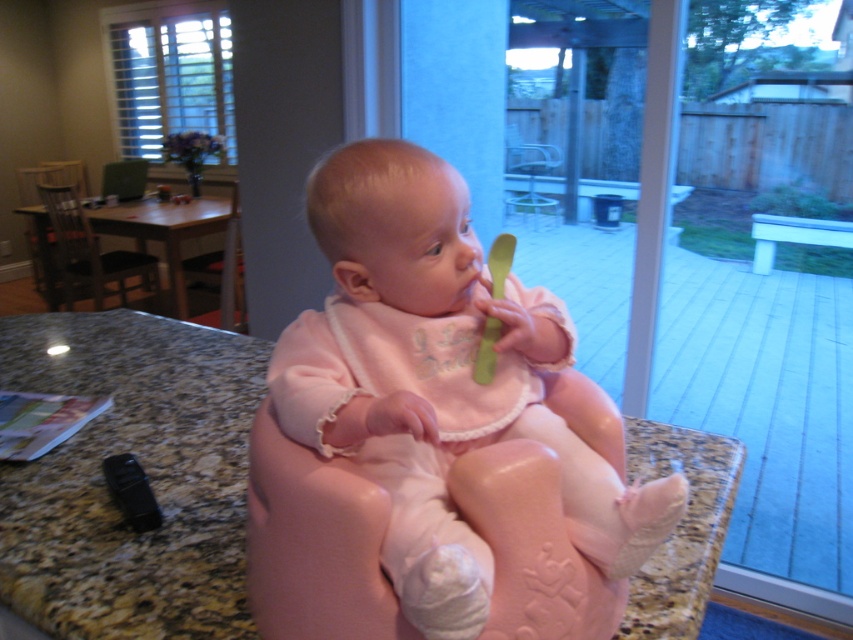
Question: Which point is closer to the camera?

Choices:
 (A) pink fabric baby at center
 (B) granite countertop at center

Answer: (A)

Question: Is pink fabric baby at center bigger than granite countertop at center?

Choices:
 (A) no
 (B) yes

Answer: (A)

Question: Which object is farther from the camera taking this photo?

Choices:
 (A) pink fabric baby at center
 (B) granite countertop at center

Answer: (B)

Question: Which point is closer to the camera?

Choices:
 (A) (74, 474)
 (B) (467, 579)

Answer: (B)

Question: Is pink fabric baby at center above granite countertop at center?

Choices:
 (A) no
 (B) yes

Answer: (B)

Question: In this image, where is pink fabric baby at center located relative to granite countertop at center?

Choices:
 (A) above
 (B) below

Answer: (A)